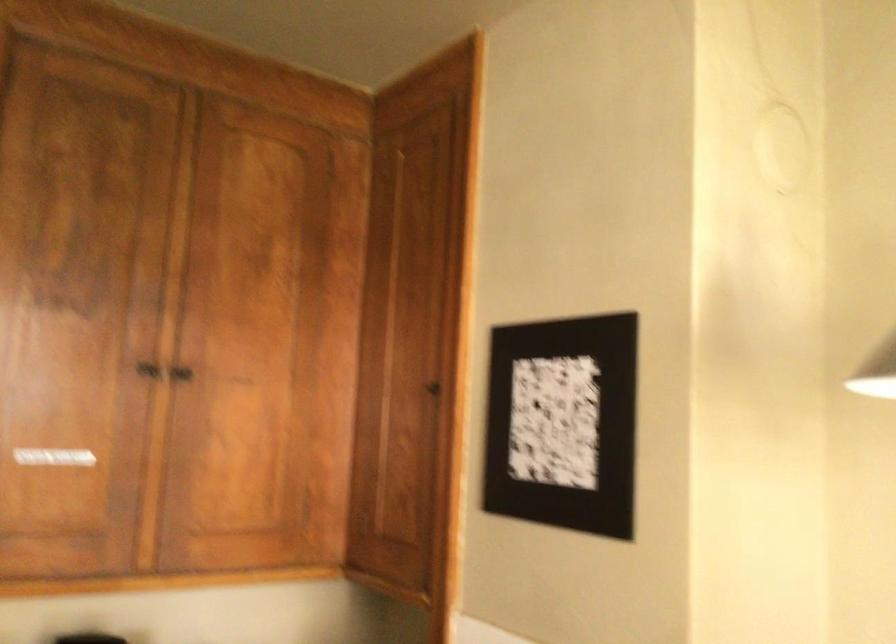
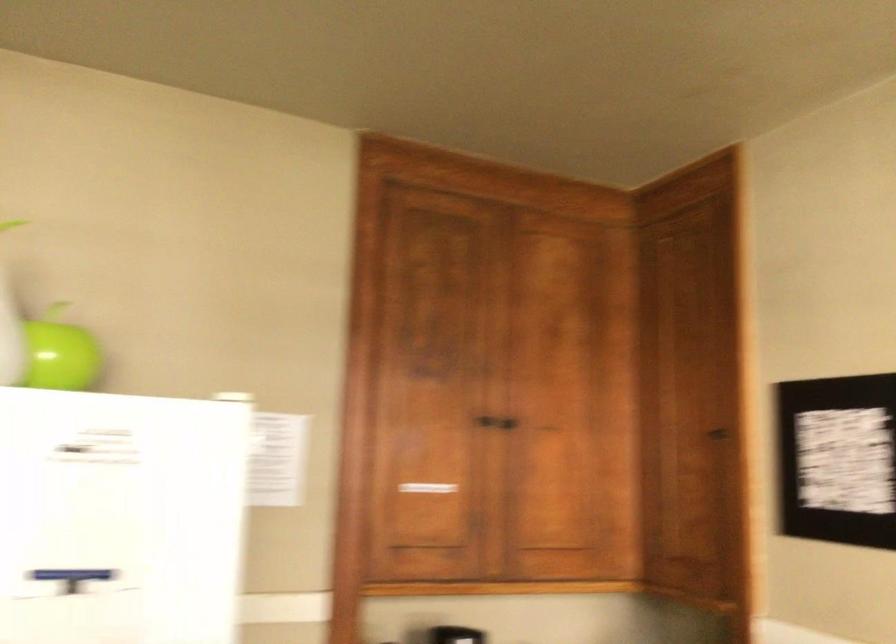
Question: The camera is either moving clockwise (left) or counter-clockwise (right) around the object. The first image is from the beginning of the video and the second image is from the end. Is the camera moving left or right when shooting the video?

Choices:
 (A) Left
 (B) Right

Answer: (B)